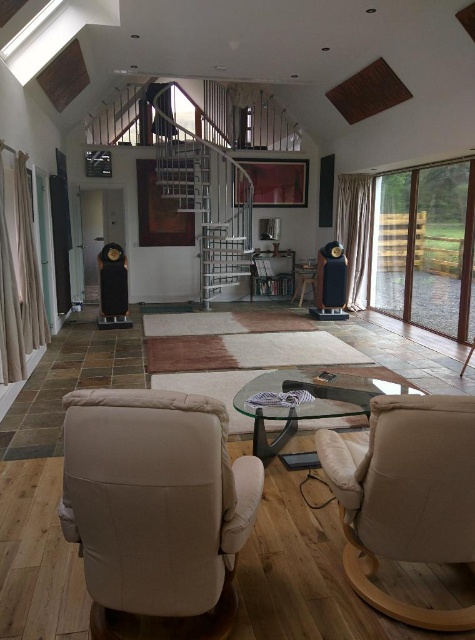
You are a delivery person trying to navigate through the living room to deliver a package to the transparent glass door at right. You are currently standing next to the beige fabric armchair at lower left. Is there enough space to walk directly to the door without moving any furniture?

The distance between the beige fabric armchair at lower left and the transparent glass door at right is 5.57 meters. Since there are no obstacles mentioned between them in the scene description, there is likely enough space to walk directly to the door without moving any furniture.

You are a visitor sitting in the beige leather armchair at lower right and want to see through the transparent glass door at right. Can you see the door completely from your current position?

The beige leather armchair at lower right has a lesser height compared to transparent glass door at right, so you may not be able to see the entire door from your seated position in the armchair.

Based on the photo, you are sitting in the beige fabric armchair at lower left and want to place a book on the transparent glass coffee table at center. Which direction should you move to reach the table?

You should move to the right to reach the transparent glass coffee table at center since the beige fabric armchair at lower left is positioned to the left of it.